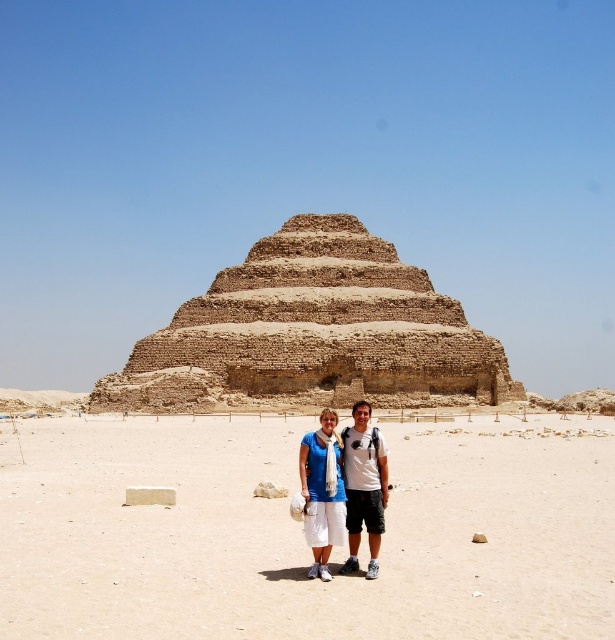
You are a photographer planning to take a photo of the Step Pyramid of Djoser. You want to ensure both the beige sandy ground at center and the matte blue shirt at center are clearly visible in the frame. Given their sizes, which object will occupy more space in the photo?

The beige sandy ground at center is larger in size than the matte blue shirt at center, so it will occupy more space in the photo.

You are planning to take a photo of the Step Pyramid of Djoser with the two tourists in the foreground. Given the beige sandy ground at center and the blue cotton shirt at center, which object would occupy more space in the photo frame?

The beige sandy ground at center occupies more space in the photo frame than the blue cotton shirt at center because it is bigger.